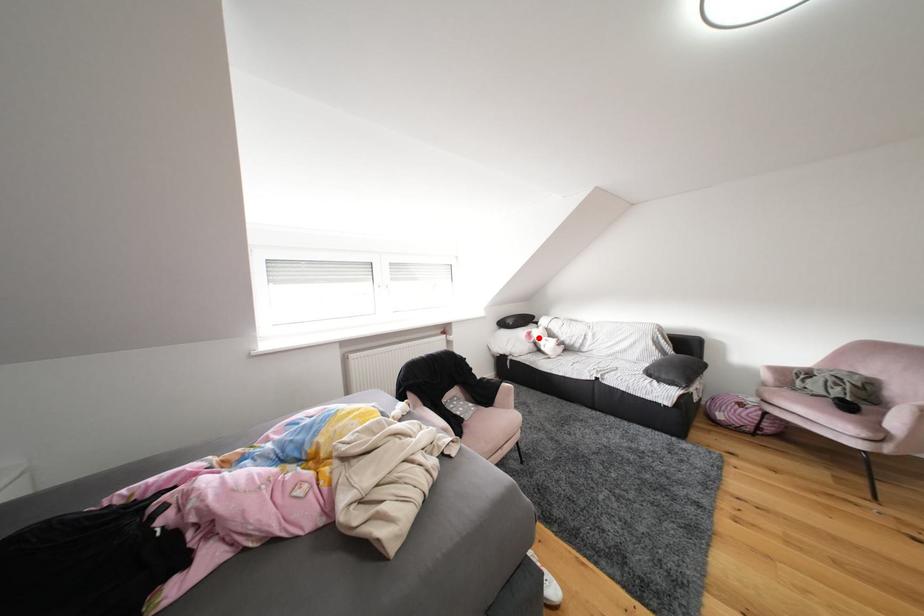
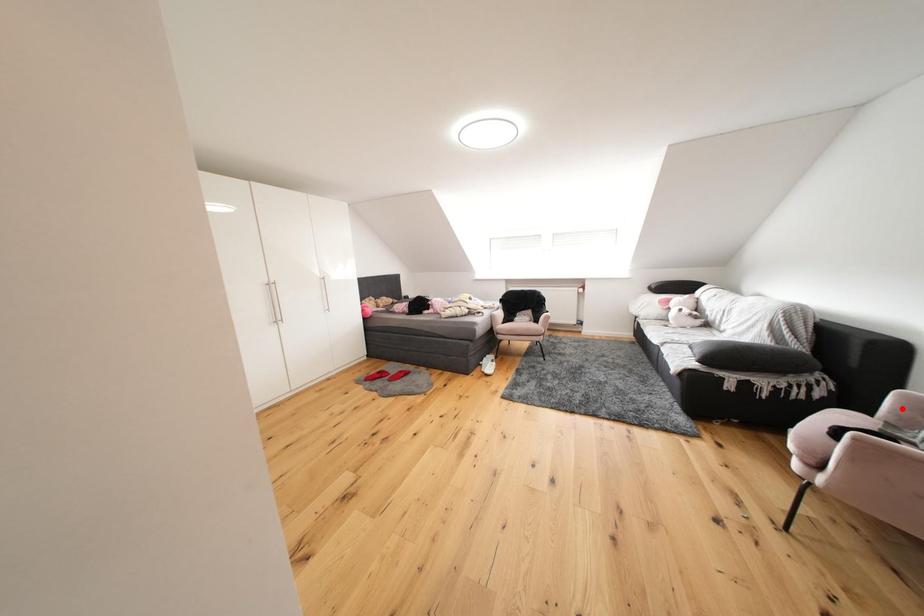
I am providing you with two images of the same scene from different viewpoints. A red point is marked on the first image and another point is marked on the second image. Is the marked point in image1 the same physical position as the marked point in image2?

No